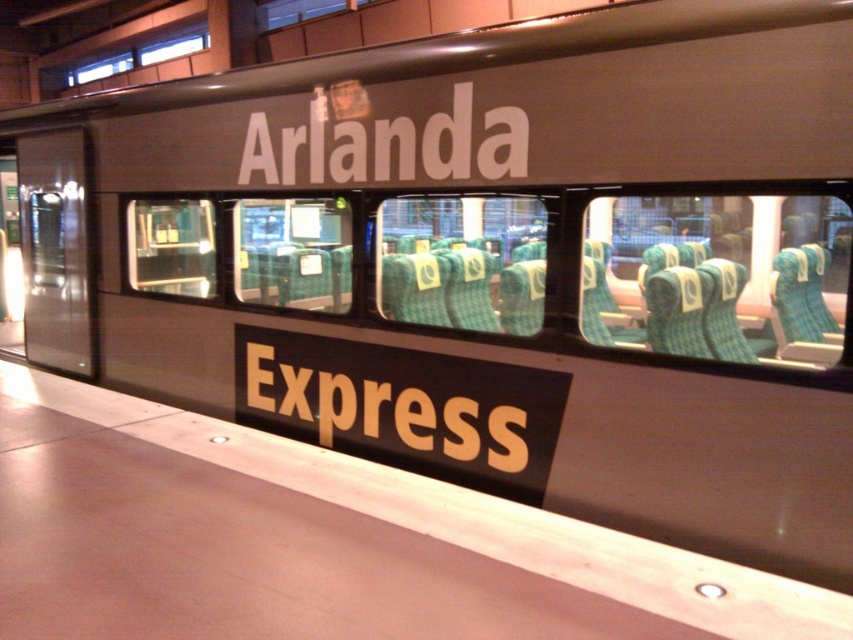
What do you see at coordinates (381, 406) in the screenshot? I see `yellow matte express at lower center` at bounding box center [381, 406].

Who is taller, yellow matte express at lower center or white matte text at center?

Standing taller between the two is yellow matte express at lower center.

The width and height of the screenshot is (853, 640). I want to click on yellow matte express at lower center, so click(381, 406).

Image resolution: width=853 pixels, height=640 pixels. Identify the location of yellow matte express at lower center. (381, 406).